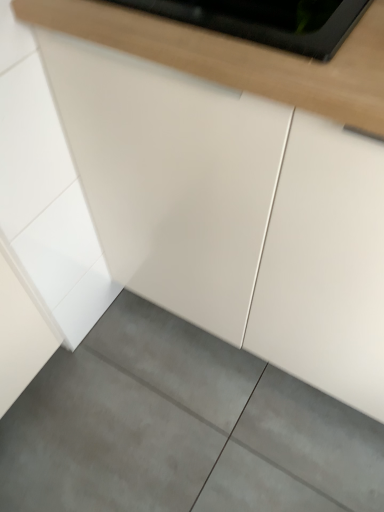
This screenshot has width=384, height=512. Find the location of `white glossy countertop at upper center`. white glossy countertop at upper center is located at coordinates (238, 57).

Measure the distance between point (162, 51) and camera.

The distance of point (162, 51) from camera is 21.65 inches.

The height and width of the screenshot is (512, 384). Describe the element at coordinates (238, 57) in the screenshot. I see `white glossy countertop at upper center` at that location.

What do you see at coordinates (181, 428) in the screenshot? I see `gray concrete floor at lower center` at bounding box center [181, 428].

Locate an element on the screen. gray concrete floor at lower center is located at coordinates (181, 428).

Identify the location of white glossy countertop at upper center. (238, 57).

Considering the positions of objects gray concrete floor at lower center and white glossy countertop at upper center in the image provided, who is more to the right, gray concrete floor at lower center or white glossy countertop at upper center?

From the viewer's perspective, white glossy countertop at upper center appears more on the right side.

Is the position of gray concrete floor at lower center less distant than that of white glossy countertop at upper center?

No, gray concrete floor at lower center is further to the viewer.

Is point (16, 508) closer to camera compared to point (113, 21)?

That is False.

From the image's perspective, is gray concrete floor at lower center above or below white glossy countertop at upper center?

Based on their image positions, gray concrete floor at lower center is located beneath white glossy countertop at upper center.

From a real-world perspective, is gray concrete floor at lower center under white glossy countertop at upper center?

Indeed, from a real-world perspective, gray concrete floor at lower center is positioned beneath white glossy countertop at upper center.

Which of these two, gray concrete floor at lower center or white glossy countertop at upper center, is wider?

gray concrete floor at lower center is wider.

Based on the photo, between gray concrete floor at lower center and white glossy countertop at upper center, which one has less height?

With less height is gray concrete floor at lower center.

Is gray concrete floor at lower center bigger or smaller than white glossy countertop at upper center?

gray concrete floor at lower center is bigger than white glossy countertop at upper center.

Do you think gray concrete floor at lower center is within white glossy countertop at upper center, or outside of it?

gray concrete floor at lower center is located beyond the bounds of white glossy countertop at upper center.

Is the surface of gray concrete floor at lower center in direct contact with white glossy countertop at upper center?

No, gray concrete floor at lower center is not beside white glossy countertop at upper center.

Is gray concrete floor at lower center oriented away from white glossy countertop at upper center?

No, gray concrete floor at lower center is not facing the opposite direction of white glossy countertop at upper center.

Locate an element on the screen. countertop above the gray concrete floor at lower center (from the image's perspective) is located at coordinates (238, 57).

Considering the relative positions of white glossy countertop at upper center and gray concrete floor at lower center in the image provided, is white glossy countertop at upper center to the right of gray concrete floor at lower center from the viewer's perspective?

Yes, white glossy countertop at upper center is to the right of gray concrete floor at lower center.

Is white glossy countertop at upper center closer to the viewer compared to gray concrete floor at lower center?

Yes, white glossy countertop at upper center is closer to the viewer.

Does point (41, 5) come behind point (132, 389)?

That is False.

From the image's perspective, is white glossy countertop at upper center located above or below gray concrete floor at lower center?

white glossy countertop at upper center is situated higher than gray concrete floor at lower center in the image.

From a real-world perspective, is white glossy countertop at upper center under gray concrete floor at lower center?

Incorrect, from a real-world perspective, white glossy countertop at upper center is higher than gray concrete floor at lower center.

In the scene shown: Considering the relative sizes of white glossy countertop at upper center and gray concrete floor at lower center in the image provided, is white glossy countertop at upper center thinner than gray concrete floor at lower center?

Indeed, white glossy countertop at upper center has a lesser width compared to gray concrete floor at lower center.

Considering the sizes of white glossy countertop at upper center and gray concrete floor at lower center in the image, is white glossy countertop at upper center taller or shorter than gray concrete floor at lower center?

In the image, white glossy countertop at upper center appears to be taller than gray concrete floor at lower center.

Which of these two, white glossy countertop at upper center or gray concrete floor at lower center, is bigger?

Bigger between the two is gray concrete floor at lower center.

Is white glossy countertop at upper center surrounding gray concrete floor at lower center?

No, gray concrete floor at lower center is located outside of white glossy countertop at upper center.

Is white glossy countertop at upper center not near gray concrete floor at lower center?

No, white glossy countertop at upper center is not far away from gray concrete floor at lower center.

Is white glossy countertop at upper center facing away from gray concrete floor at lower center?

No, white glossy countertop at upper center's orientation is not away from gray concrete floor at lower center.

Identify the location of countertop on the right of gray concrete floor at lower center. This screenshot has width=384, height=512. (238, 57).

Locate an element on the screen. The width and height of the screenshot is (384, 512). concrete that appears below the white glossy countertop at upper center (from the image's perspective) is located at coordinates (181, 428).

Where is `countertop that is on the right side of gray concrete floor at lower center`? countertop that is on the right side of gray concrete floor at lower center is located at coordinates (238, 57).